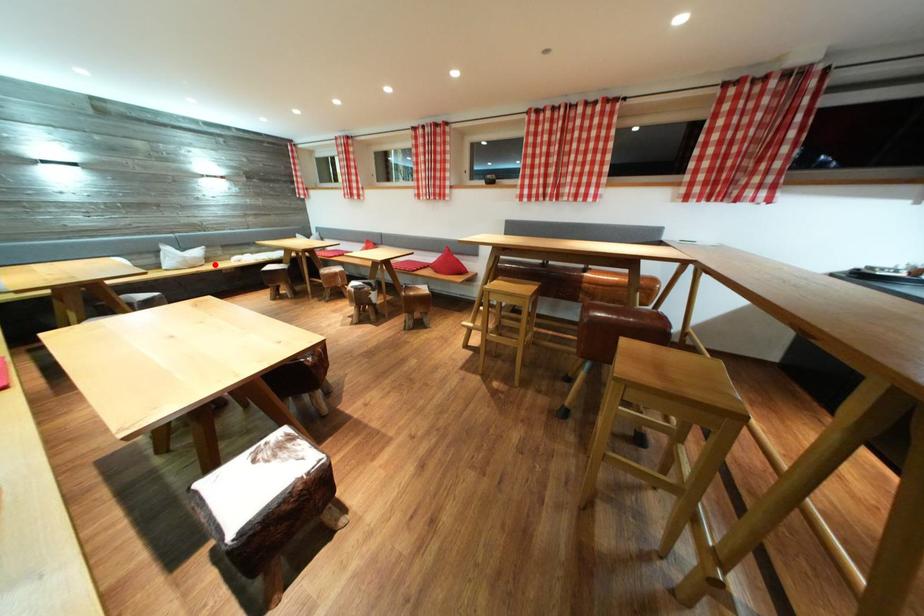
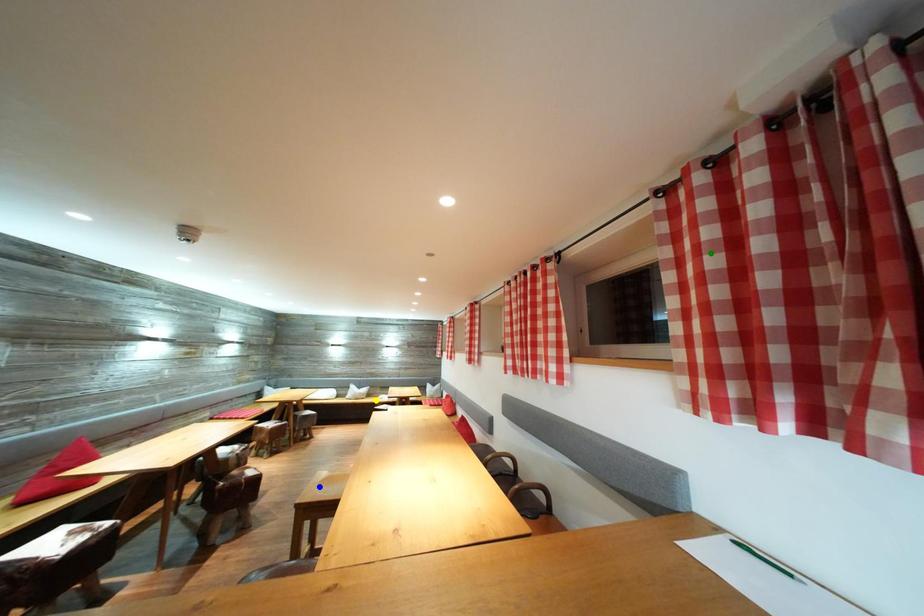
Question: I am providing you with two images of the same scene from different viewpoints. A red point is marked on the first image. You are given multiple points on the second image. In image 2, which mark is for the same physical point as the one in image 1?

Choices:
 (A) yellow point
 (B) blue point
 (C) green point

Answer: (A)